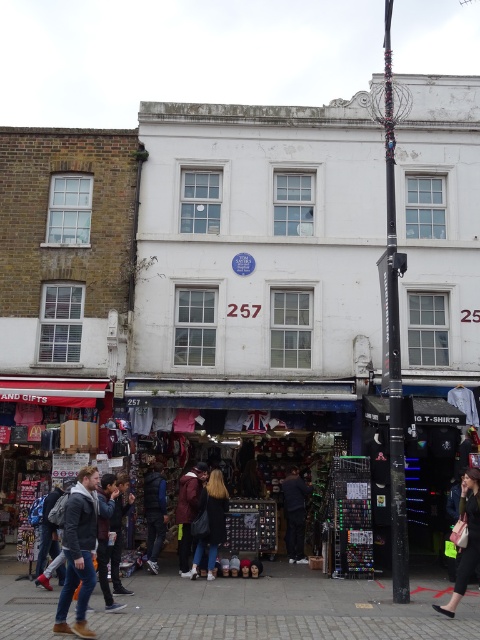
Consider the image. You are standing at the point closest to the building in this street scene. There are two points marked on the image, one at point (477,529) and another at point (297,552). Which of these points is closer to you?

Point (477,529) is in front of point (297,552), so the point closer to you is point (477,529).

You are standing on the street in front of the building. You see a point marked at coordinates (468, 538). Which object is located at that point?

The point at coordinates (468, 538) corresponds to the matte black jacket at lower right.